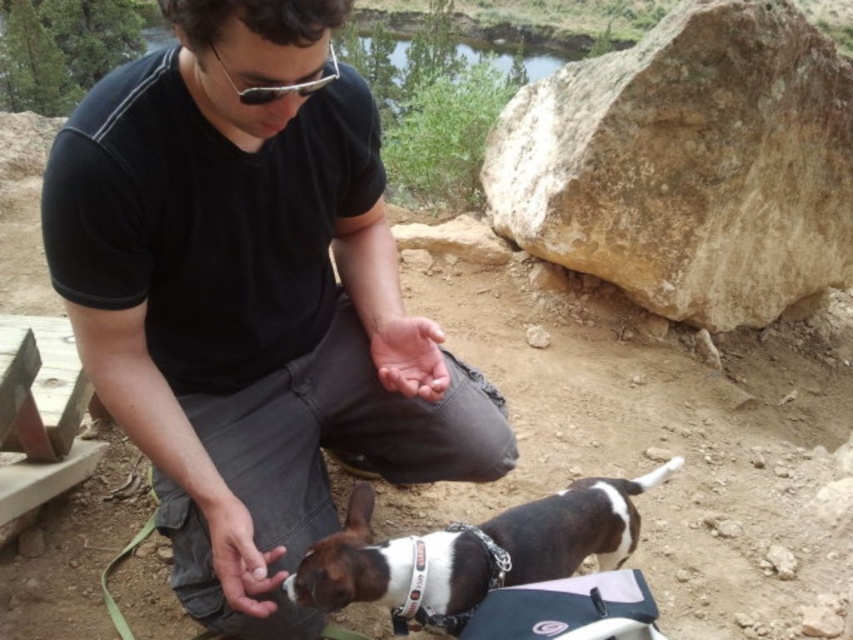
Between brown rough rock at upper right and white and brown fur at lower center, which one has less height?

white and brown fur at lower center is shorter.

Does point (822, 288) come farther from viewer compared to point (413, 588)?

Yes, point (822, 288) is behind point (413, 588).

Find the location of a particular element. brown rough rock at upper right is located at coordinates (688, 164).

Can you confirm if black cotton shirt at center is positioned below brown rough rock at upper right?

Correct, black cotton shirt at center is located below brown rough rock at upper right.

Who is shorter, black cotton shirt at center or brown rough rock at upper right?

With less height is black cotton shirt at center.

Which is behind, point (360, 396) or point (595, 81)?

The point (595, 81) is behind.

Where is `black cotton shirt at center`? black cotton shirt at center is located at coordinates (250, 300).

What do you see at coordinates (250, 300) in the screenshot? I see `black cotton shirt at center` at bounding box center [250, 300].

Measure the distance between point (x=376, y=378) and camera.

They are 1.63 meters apart.

Which is in front, point (173, 508) or point (287, 588)?

Point (287, 588) is in front.

I want to click on black cotton shirt at center, so click(250, 300).